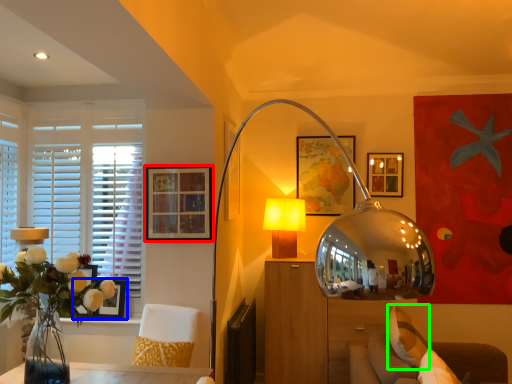
Question: Which object is the farthest from picture frame (highlighted by a red box)? Choose among these: picture frame (highlighted by a blue box) or pillow (highlighted by a green box).

Choices:
 (A) picture frame
 (B) pillow

Answer: (B)